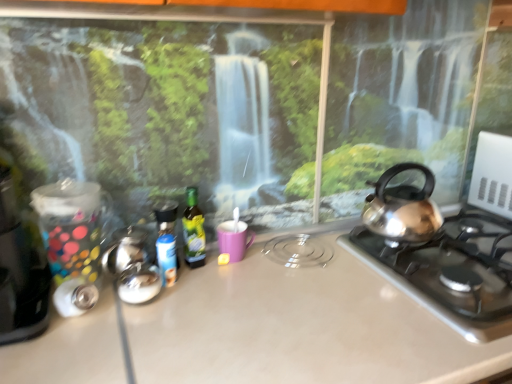
What are the coordinates of `unoccupied region to the right of green glass bottle at center, arranged as the 1th bottle when viewed from the right` in the screenshot? It's located at (260, 269).